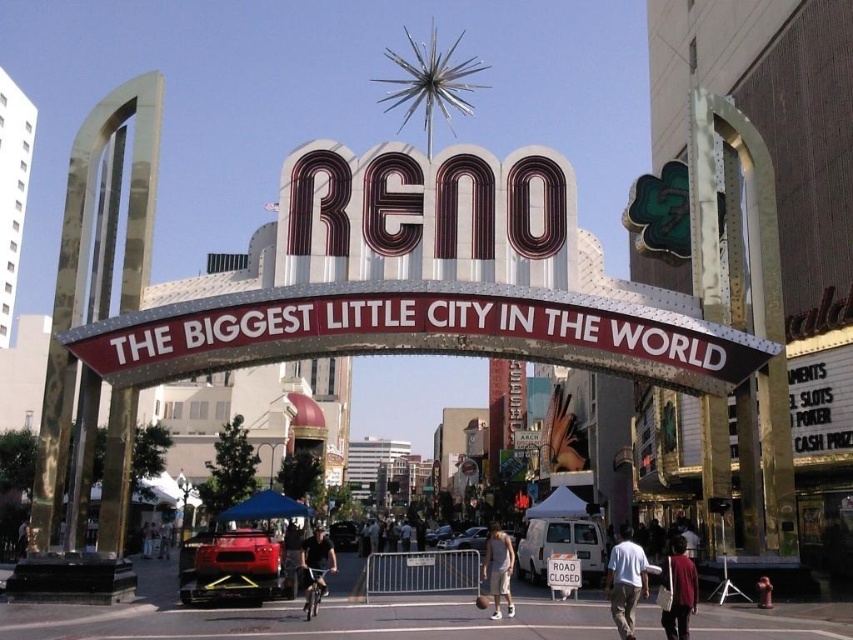
Is light brown fabric shorts at center closer to camera compared to white plastic road sign at center?

Yes, light brown fabric shorts at center is closer to the viewer.

Is light brown fabric shorts at center taller than white plastic road sign at center?

Correct, light brown fabric shorts at center is much taller as white plastic road sign at center.

Where is `light brown fabric shorts at center`? light brown fabric shorts at center is located at coordinates (498, 568).

In the scene shown: Between maroon fabric shirt at lower right and light brown fabric shorts at center, which one appears on the left side from the viewer's perspective?

light brown fabric shorts at center

Between maroon fabric shirt at lower right and light brown fabric shorts at center, which one appears on the right side from the viewer's perspective?

maroon fabric shirt at lower right is more to the right.

Between point (691, 584) and point (498, 604), which one is positioned behind?

The point (498, 604) is behind.

You are a GUI agent. You are given a task and a screenshot of the screen. Output one action in this format:
    pyautogui.click(x=<x>, y=<y>)
    Task: Click on the maroon fabric shirt at lower right
    
    Given the screenshot: What is the action you would take?
    pyautogui.click(x=679, y=589)

Who is shorter, white cotton shirt at center or light brown fabric shorts at center?

Standing shorter between the two is white cotton shirt at center.

Which is behind, point (619, 621) or point (498, 532)?

The point (498, 532) is behind.

Find the location of a particular element. This screenshot has width=853, height=640. white cotton shirt at center is located at coordinates (625, 580).